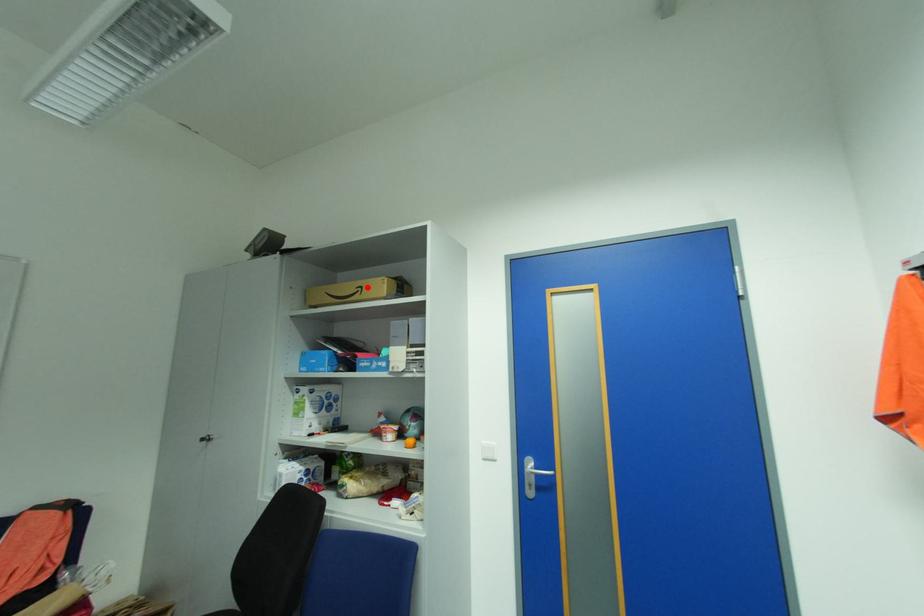
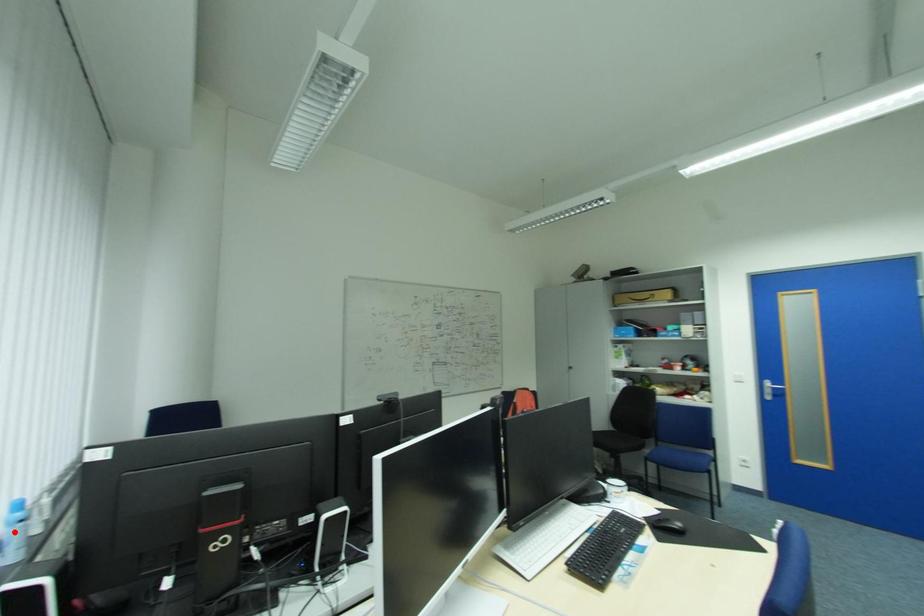
I am providing you with two images of the same scene from different viewpoints. A red point is marked on the first image and another point is marked on the second image. Are the points marked in image1 and image2 representing the same 3D position?

No